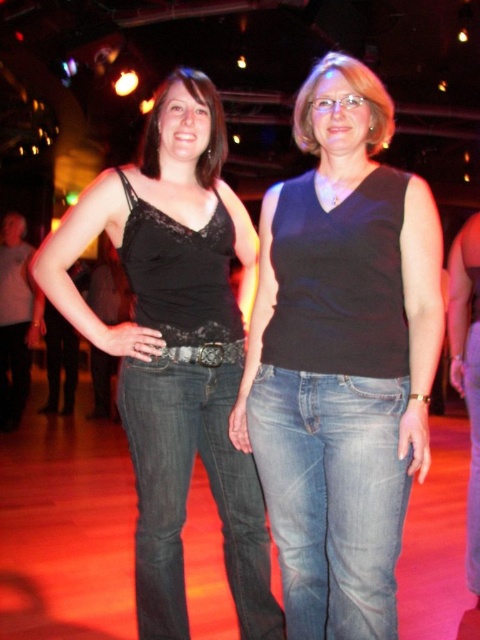
You are a photographer adjusting camera settings for a portrait. You notice two women in the scene wearing black matte tank tops. The one on the left is wearing a matte black tank top at left, and the one on the right is wearing a black matte tank top at center. Which woman should you focus on to ensure the tank top appears larger in the photo?

The matte black tank top at left has a greater height compared to the black matte tank top at center. Therefore, focusing on the woman wearing the matte black tank top at left will make her tank top appear larger in the photo.

You are a fashion designer observing two women at an event. The woman on the left is wearing a matte black tank top at left, and the woman at center is wearing a black matte tank top at center. Which woman is wearing the wider tank top?

The matte black tank top at left is wider than the black matte tank top at center, so the woman on the left is wearing the wider tank top.

You are a photographer adjusting your camera settings to focus on two points in the image. The points are labeled as point (435, 326) and point (233, 396). Which point should you focus on first if you want to ensure the closest object is in focus?

You should focus on point (435, 326) first because it is closer to the viewer than point (233, 396), ensuring the closest object is in focus.